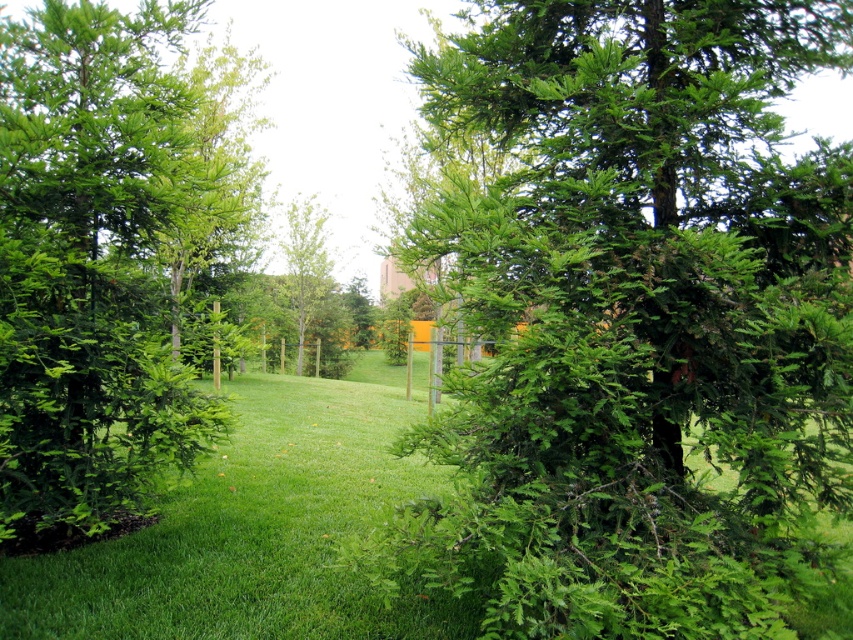
You are standing at the center of the grassy area in the park scene. You notice a specific point marked at coordinates point (109, 259). What type of vegetation is located at that exact point?

At point (109, 259) lies green needle like vegetation.